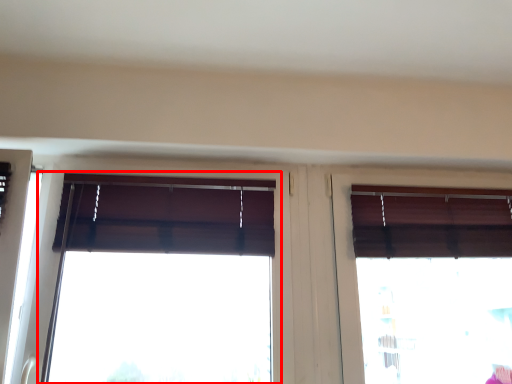
Question: From the image's perspective, where is window (annotated by the red box) located relative to window?

Choices:
 (A) below
 (B) above

Answer: (B)